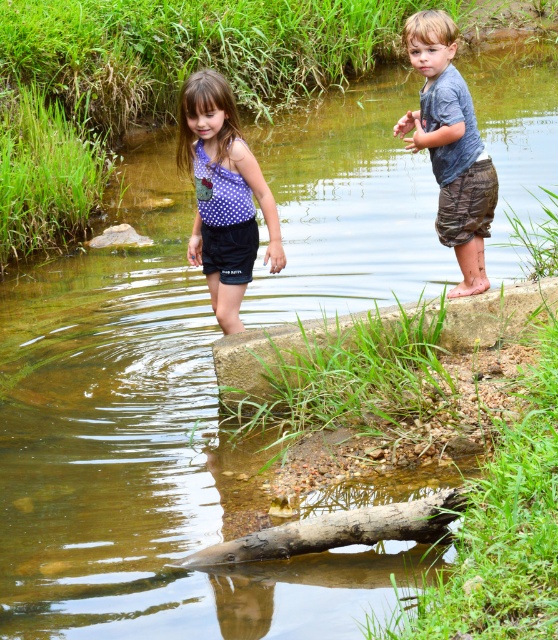
Question: Is green grassy stone at center thinner than camouflage shorts at right?

Choices:
 (A) no
 (B) yes

Answer: (A)

Question: Which object appears closest to the camera in this image?

Choices:
 (A) brown rough log at center
 (B) polka dot fabric dress at center
 (C) green grassy stone at center

Answer: (A)

Question: Is camouflage shorts at right positioned at the back of brown rough log at center?

Choices:
 (A) no
 (B) yes

Answer: (B)

Question: In this image, where is green grassy stone at center located relative to polka dot fabric dress at center?

Choices:
 (A) left
 (B) right

Answer: (B)

Question: Which object is farther from the camera taking this photo?

Choices:
 (A) green grassy stone at center
 (B) camouflage shorts at right
 (C) polka dot fabric dress at center

Answer: (C)

Question: Which object is farther from the camera taking this photo?

Choices:
 (A) green grassy stone at center
 (B) polka dot fabric dress at center
 (C) camouflage shorts at right
 (D) brown rough log at center

Answer: (B)